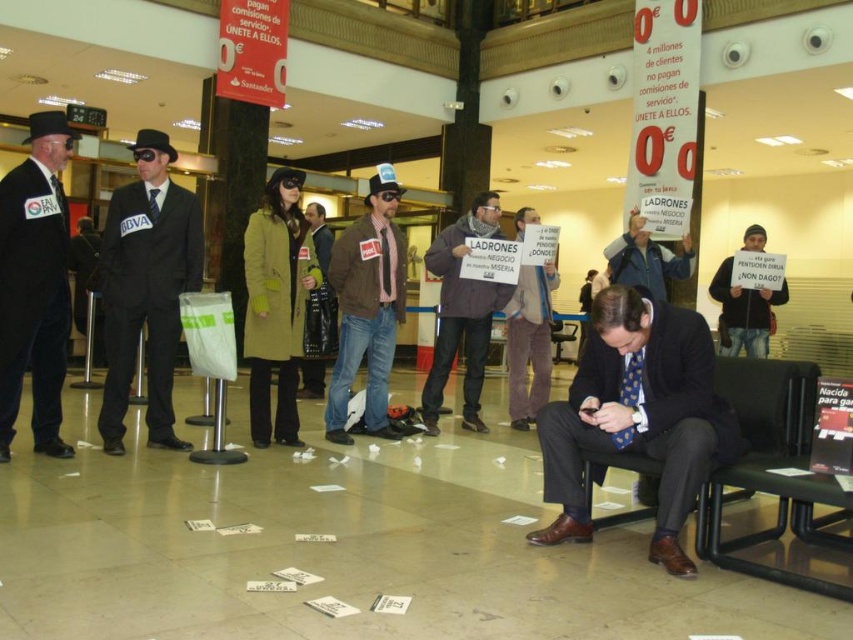
You are a photographer trying to capture the protest scene. You need to position yourself so that both the dark brown leather jacket at center and the black fabric sign at lower right are visible in your frame. Based on their positions, which object should you place closer to the left side of your camera viewfinder to ensure both are included?

To include both the dark brown leather jacket at center and the black fabric sign at lower right in your frame, position the dark brown leather jacket at center closer to the left side of your viewfinder since it is already to the left of the black fabric sign at lower right.

In the scene shown: You are a participant in the protest and need to retrieve your dark brown leather jacket at center. However, there is a black fabric sign at lower right blocking your path. Based on the scene description, can you reach your jacket without moving the sign?

The dark brown leather jacket at center is below the black fabric sign at lower right, meaning the sign is above the jacket. Since the sign is at lower right and the jacket is below it, you can likely reach the jacket without moving the sign as the sign is positioned above, not in front, blocking your path.

You are a photographer standing in the middle of the protest scene. You want to take a photo of both the matte black suit at center and the gray fabric jacket at center without moving either subject. Is there enough space between them to ensure both are in frame without overlapping?

The distance between the matte black suit at center and the gray fabric jacket at center is 8.60 feet, which should provide sufficient space to capture both subjects in the frame without overlapping, assuming the camera has an appropriate lens or zoom capability.